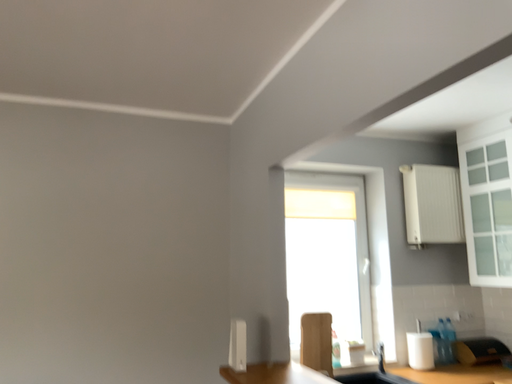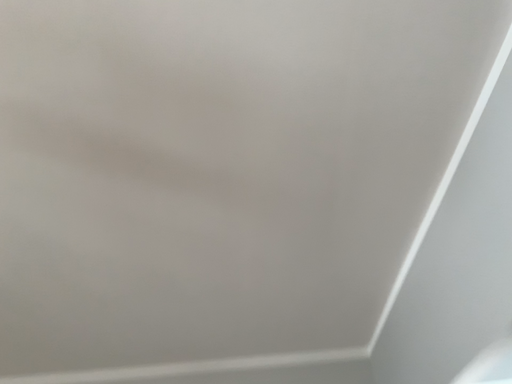
Question: How did the camera likely rotate when shooting the video?

Choices:
 (A) rotated downward
 (B) rotated upward

Answer: (B)